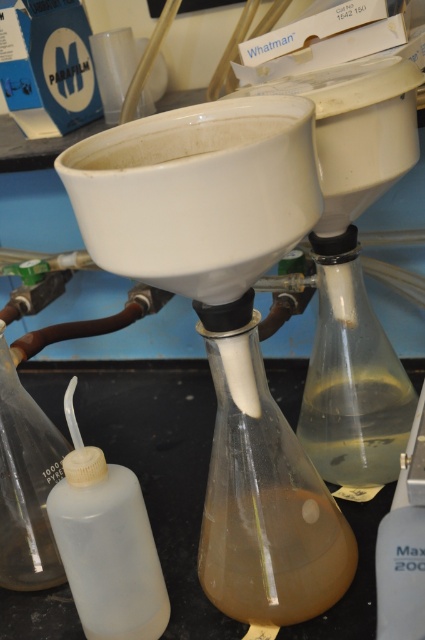
Does white matte funnel at center appear on the left side of translucent plastic bottle at lower left?

In fact, white matte funnel at center is to the right of translucent plastic bottle at lower left.

Measure the distance from white matte funnel at center to translucent plastic bottle at lower left.

white matte funnel at center is 5.78 inches from translucent plastic bottle at lower left.

Does point (203, 220) lie in front of point (79, 548)?

Yes, point (203, 220) is closer to viewer.

The width and height of the screenshot is (425, 640). What are the coordinates of `white matte funnel at center` in the screenshot? It's located at (226, 324).

Does white matte funnel at center appear over brown translucent liquid at center?

Yes.

In the scene shown: Who is higher up, white matte funnel at center or brown translucent liquid at center?

white matte funnel at center is higher up.

Does point (261, 552) come farther from viewer compared to point (292, 509)?

No, (261, 552) is in front of (292, 509).

What are the coordinates of `white matte funnel at center` in the screenshot? It's located at (226, 324).

What do you see at coordinates (226, 324) in the screenshot?
I see `white matte funnel at center` at bounding box center [226, 324].

Is white matte funnel at center closer to camera compared to translucent gel-like liquid at center?

Yes, it is.

What do you see at coordinates (226, 324) in the screenshot? This screenshot has width=425, height=640. I see `white matte funnel at center` at bounding box center [226, 324].

Identify the location of white matte funnel at center. (226, 324).